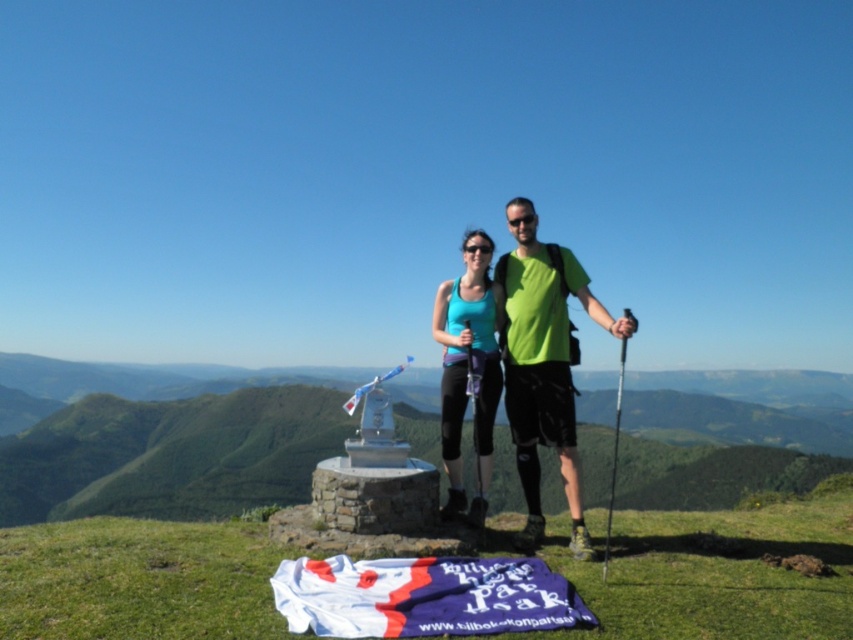
Between point (573, 344) and point (444, 310), which one is positioned behind?

Point (444, 310)

In order to click on green matte tank top at center in this screenshot , I will do `click(543, 364)`.

Does white fabric flag at lower center have a lesser height compared to green matte tank top at center?

Yes, white fabric flag at lower center is shorter than green matte tank top at center.

Who is more forward, (422, 611) or (537, 392)?

Point (422, 611) is more forward.

Where is `white fabric flag at lower center`? This screenshot has width=853, height=640. white fabric flag at lower center is located at coordinates (422, 596).

Does white fabric flag at lower center appear on the right side of teal fabric tank top at center?

In fact, white fabric flag at lower center is to the left of teal fabric tank top at center.

Which of these two, white fabric flag at lower center or teal fabric tank top at center, stands shorter?

white fabric flag at lower center is shorter.

Measure the distance between white fabric flag at lower center and camera.

The distance of white fabric flag at lower center from camera is 14.17 feet.

Locate an element on the screen. This screenshot has width=853, height=640. white fabric flag at lower center is located at coordinates (422, 596).